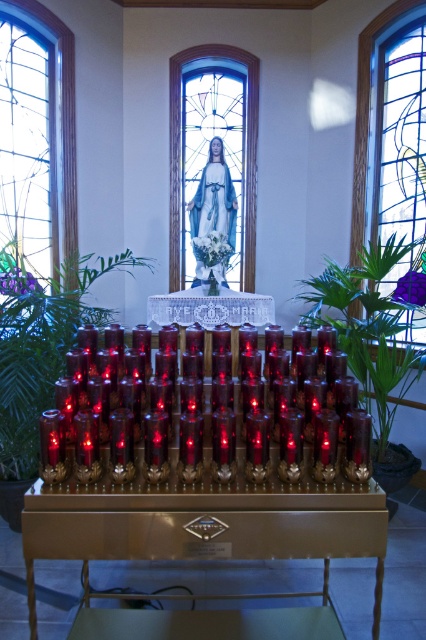
Can you confirm if green leafy plant at left is shorter than clear glass stained glass at left?

Correct, green leafy plant at left is not as tall as clear glass stained glass at left.

Looking at this image, is green leafy plant at left positioned at the back of clear glass stained glass at left?

No.

Which is in front, point (71, 323) or point (51, 86)?

Point (71, 323)

Identify the location of green leafy plant at left. (40, 346).

Is gold metallic table at center further to the viewer compared to clear glass stained glass at left?

No, it is in front of clear glass stained glass at left.

Which is below, gold metallic table at center or clear glass stained glass at left?

gold metallic table at center is below.

Between point (101, 529) and point (36, 32), which one is positioned in front?

Point (101, 529)

Image resolution: width=426 pixels, height=640 pixels. What are the coordinates of `gold metallic table at center` in the screenshot? It's located at (204, 524).

Does translucent glass candle at center have a lesser height compared to green leafy plant at center?

Yes, translucent glass candle at center is shorter than green leafy plant at center.

Does translucent glass candle at center have a greater height compared to green leafy plant at center?

In fact, translucent glass candle at center may be shorter than green leafy plant at center.

Between point (293, 381) and point (420, 356), which one is positioned in front?

Point (293, 381) is more forward.

At what (x,y) coordinates should I click in order to perform the action: click on translucent glass candle at center. Please return your answer as a coordinate pair (x, y). The image size is (426, 640). Looking at the image, I should click on (236, 429).